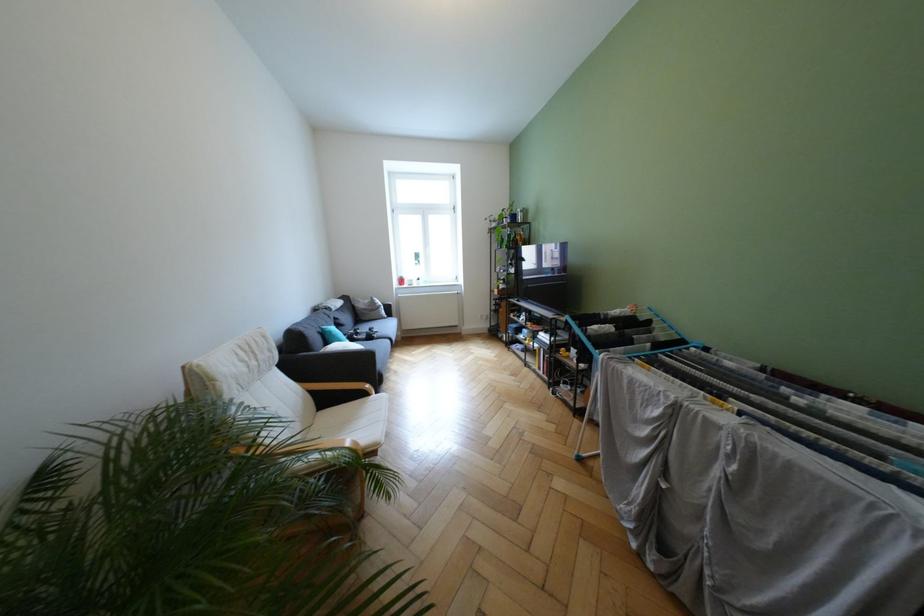
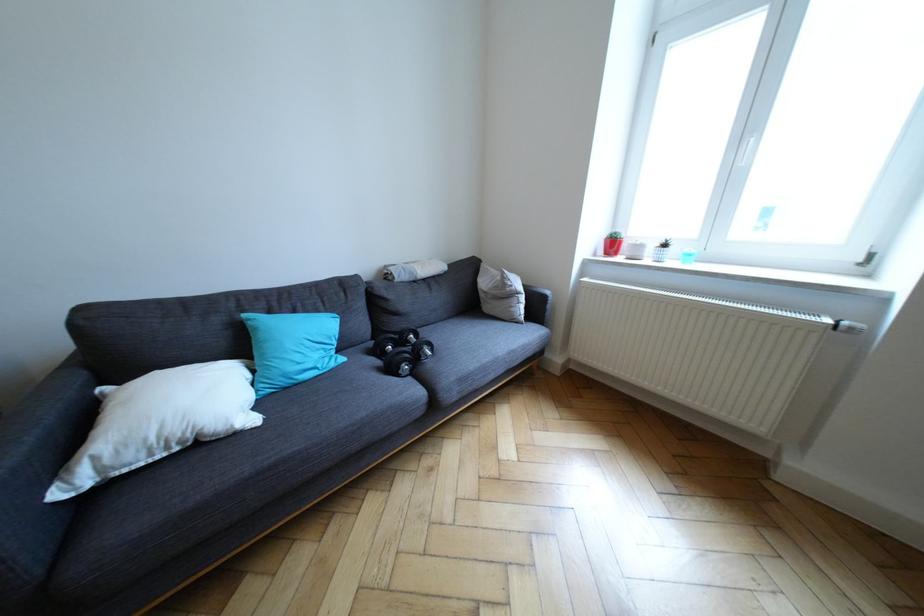
Find the pixel in the second image that matches the point at 414,285 in the first image.

(626, 254)